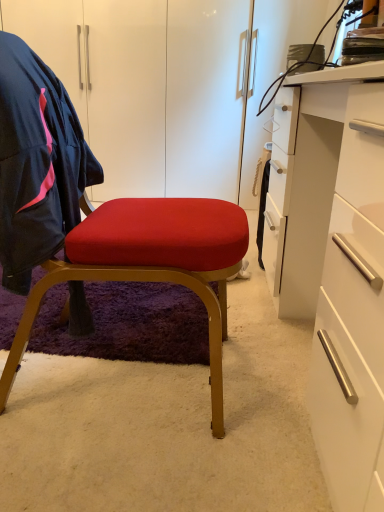
Question: Considering the relative sizes of velvet red cushion at center and navy blue fabric jacket at left in the image provided, is velvet red cushion at center bigger than navy blue fabric jacket at left?

Choices:
 (A) no
 (B) yes

Answer: (B)

Question: Is there a large distance between velvet red cushion at center and navy blue fabric jacket at left?

Choices:
 (A) yes
 (B) no

Answer: (B)

Question: Is velvet red cushion at center behind navy blue fabric jacket at left?

Choices:
 (A) yes
 (B) no

Answer: (B)

Question: Can you confirm if velvet red cushion at center is taller than navy blue fabric jacket at left?

Choices:
 (A) no
 (B) yes

Answer: (B)

Question: Is velvet red cushion at center beside navy blue fabric jacket at left?

Choices:
 (A) no
 (B) yes

Answer: (A)

Question: Considering the relative positions of velvet red cushion at center and navy blue fabric jacket at left in the image provided, is velvet red cushion at center to the right of navy blue fabric jacket at left from the viewer's perspective?

Choices:
 (A) no
 (B) yes

Answer: (B)

Question: Is velvet red cushion at center turned away from white glossy desk at right?

Choices:
 (A) no
 (B) yes

Answer: (A)

Question: Considering the relative sizes of velvet red cushion at center and white glossy desk at right in the image provided, is velvet red cushion at center shorter than white glossy desk at right?

Choices:
 (A) no
 (B) yes

Answer: (A)

Question: Is the position of velvet red cushion at center less distant than that of white glossy desk at right?

Choices:
 (A) no
 (B) yes

Answer: (A)

Question: Is the depth of velvet red cushion at center greater than that of white glossy desk at right?

Choices:
 (A) yes
 (B) no

Answer: (A)

Question: From a real-world perspective, is velvet red cushion at center located beneath white glossy desk at right?

Choices:
 (A) no
 (B) yes

Answer: (A)

Question: From a real-world perspective, is velvet red cushion at center on white glossy desk at right?

Choices:
 (A) no
 (B) yes

Answer: (B)

Question: Considering the relative sizes of navy blue fabric jacket at left and velvet red cushion at center in the image provided, is navy blue fabric jacket at left taller than velvet red cushion at center?

Choices:
 (A) no
 (B) yes

Answer: (A)